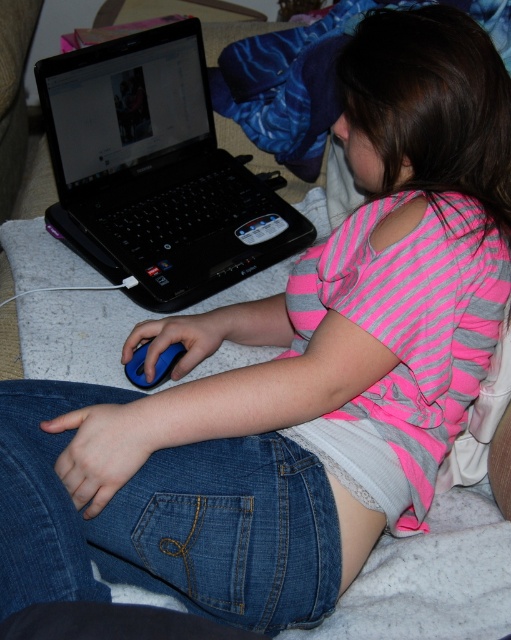
Does denim at lower center come in front of black plastic laptop at upper left?

That is True.

Looking at this image, is denim at lower center to the right of black plastic laptop at upper left from the viewer's perspective?

Yes, denim at lower center is to the right of black plastic laptop at upper left.

Find the location of a particular element. denim at lower center is located at coordinates (168, 520).

Between point (113, 250) and point (168, 364), which one is positioned in front?

Point (168, 364) is in front.

Which is more to the left, black plastic laptop at upper left or blue rubber mouse at lower left?

From the viewer's perspective, blue rubber mouse at lower left appears more on the left side.

Is point (174, 38) farther from camera compared to point (176, 346)?

Yes.

The width and height of the screenshot is (511, 640). I want to click on black plastic laptop at upper left, so click(155, 172).

Does denim at lower center have a greater width compared to blue rubber mouse at lower left?

Yes, denim at lower center is wider than blue rubber mouse at lower left.

Between point (108, 528) and point (143, 348), which one is positioned behind?

Positioned behind is point (143, 348).

At what (x,y) coordinates should I click in order to perform the action: click on denim at lower center. Please return your answer as a coordinate pair (x, y). The height and width of the screenshot is (640, 511). Looking at the image, I should click on click(x=168, y=520).